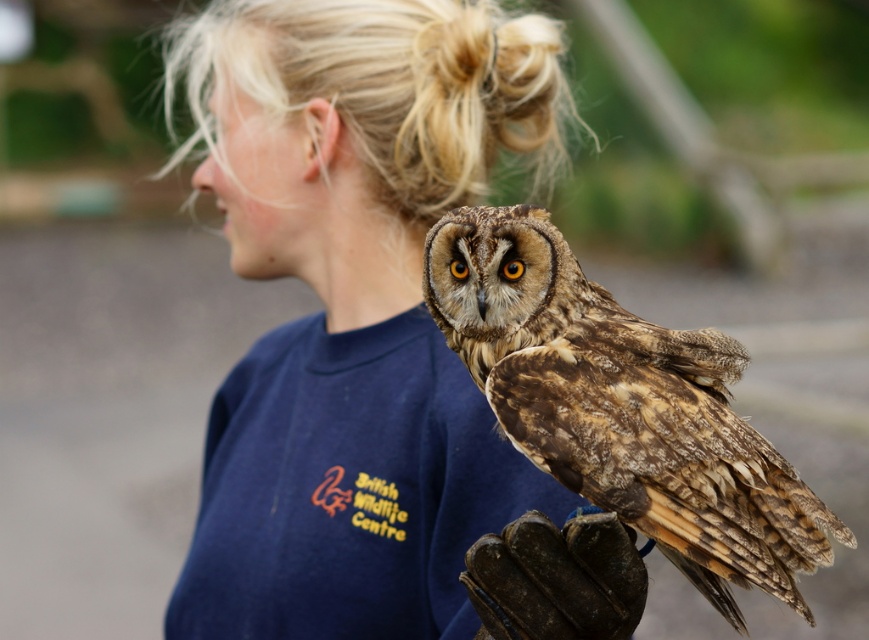
You are a photographer trying to capture the perfect shot of the brown speckled owl at center. The camera you are using has a focus point at coordinates 0.637, 0.718. Will the owl be in focus?

The 2D location of the brown speckled owl at center is at point (x=622, y=406), so yes, the owl will be in focus because the camera focus point matches its location.